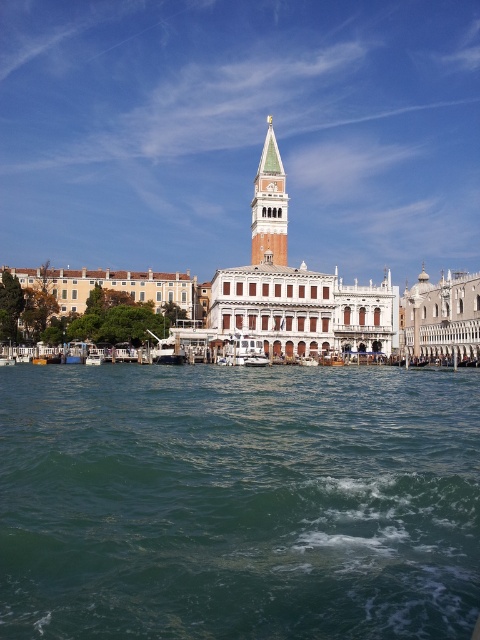
Who is more forward, [278,196] or [264,362]?

Point [264,362]

In the scene shown: Is green marble bell tower at upper center further to the viewer compared to white glossy boat at center?

That is True.

Describe the element at coordinates (269, 205) in the screenshot. The image size is (480, 640). I see `green marble bell tower at upper center` at that location.

This screenshot has height=640, width=480. Identify the location of green marble bell tower at upper center. (269, 205).

Which is more to the left, green water at center or green marble bell tower at upper center?

green water at center

Is green water at center smaller than green marble bell tower at upper center?

Incorrect, green water at center is not smaller in size than green marble bell tower at upper center.

Describe the element at coordinates (239, 502) in the screenshot. I see `green water at center` at that location.

What are the coordinates of `green water at center` in the screenshot? It's located at (239, 502).

Which is below, green water at center or white glossy boat at center?

green water at center

Is green water at center positioned behind white glossy boat at center?

No, green water at center is closer to the viewer.

Between point (308, 548) and point (228, 353), which one is positioned in front?

Point (308, 548) is in front.

Image resolution: width=480 pixels, height=640 pixels. I want to click on green water at center, so click(x=239, y=502).